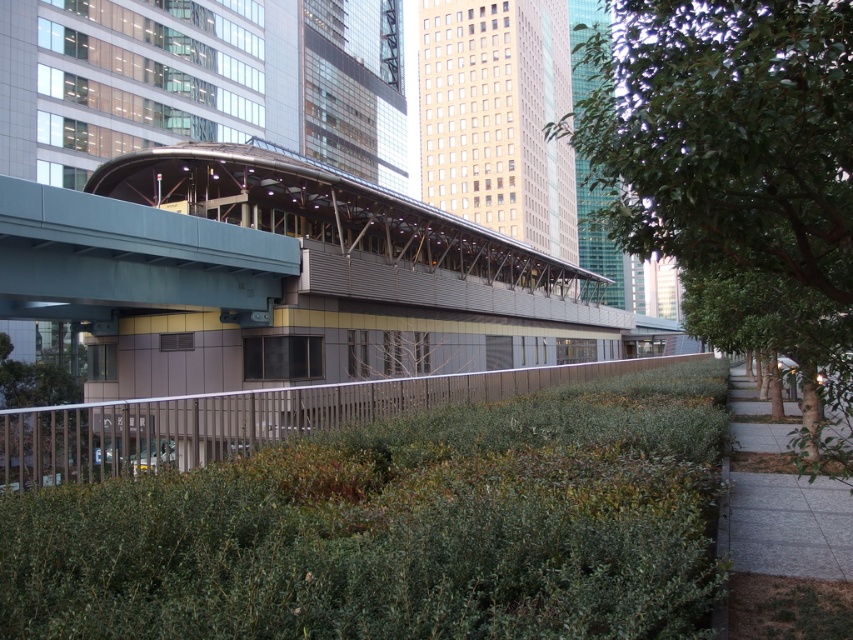
You are standing at the point marked by the coordinates point [399,528] in the image. What object are you facing?

The point [399,528] indicates green leafy hedge at lower center, so you are facing the green leafy hedge at lower center.

You are a pedestrian standing on the gray concrete sidewalk at lower right and want to walk under the green leafy tree at right. Is the tree directly above the sidewalk you are standing on?

The green leafy tree at right is positioned over gray concrete sidewalk at lower right, so yes, the tree is directly above the sidewalk you are standing on.

You are a city planner reviewing this urban design. You need to determine if the green leafy hedge at lower center can be replaced with a larger version of itself without encroaching on the gray concrete sidewalk at lower right. What should you consider based on their sizes?

The green leafy hedge at lower center is smaller than the gray concrete sidewalk at lower right. Since the sidewalk is larger, there might be enough space to accommodate a larger hedge without encroaching, but you should verify the exact dimensions and spacing between them to ensure compliance with design guidelines.